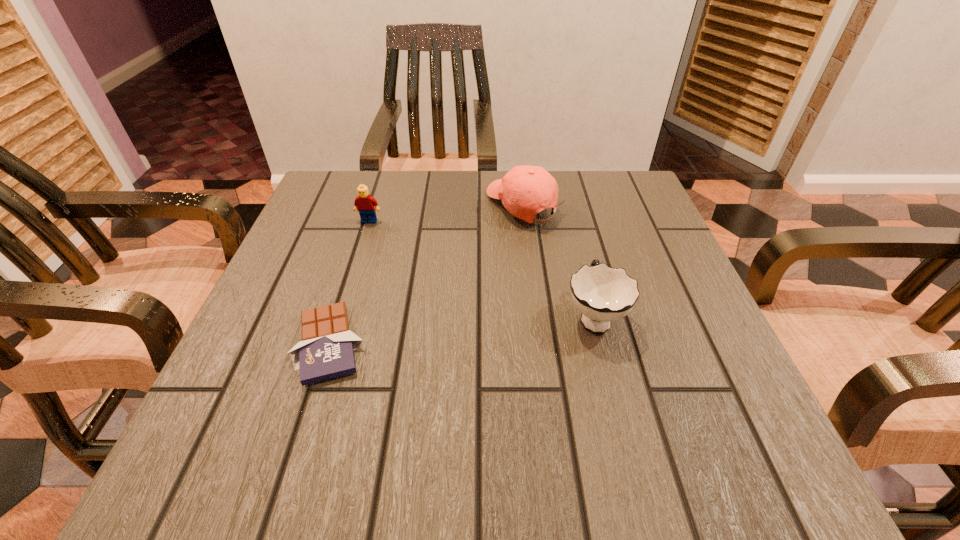
The height and width of the screenshot is (540, 960). Find the location of `vacant space at the near left corner`. vacant space at the near left corner is located at coordinates (223, 463).

Find the location of a particular element. vacant space at the far right corner of the desktop is located at coordinates (633, 213).

At what (x,y) coordinates should I click in order to perform the action: click on vacant point located between the chocolate bar and the cup. Please return your answer as a coordinate pair (x, y). The image size is (960, 540). Looking at the image, I should click on (462, 330).

Identify the location of vacant region between the cup and the baseball cap. This screenshot has height=540, width=960. (559, 261).

The height and width of the screenshot is (540, 960). In order to click on unoccupied area between the chocolate bar and the cup in this screenshot , I will do `click(462, 330)`.

This screenshot has width=960, height=540. What are the coordinates of `free space between the baseball cap and the cup` in the screenshot? It's located at (559, 261).

Where is `free space between the chocolate bar and the Lego`? free space between the chocolate bar and the Lego is located at coordinates (349, 282).

Locate an element on the screen. This screenshot has width=960, height=540. unoccupied area between the baseball cap and the Lego is located at coordinates (446, 213).

The image size is (960, 540). What are the coordinates of `vacant space in between the Lego and the baseball cap` in the screenshot? It's located at (446, 213).

The width and height of the screenshot is (960, 540). I want to click on free point between the baseball cap and the cup, so click(559, 261).